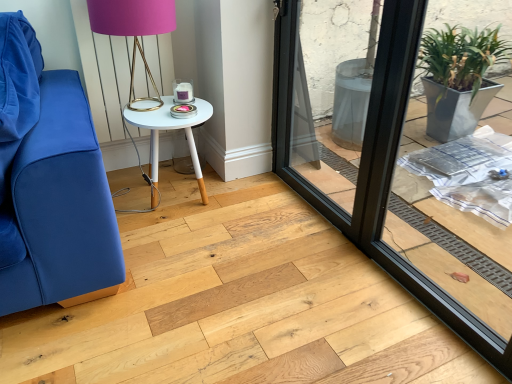
Question: Is matte gold table lamp at upper center to the left or to the right of black glass window frame at center in the image?

Choices:
 (A) left
 (B) right

Answer: (A)

Question: Is matte gold table lamp at upper center taller or shorter than black glass window frame at center?

Choices:
 (A) short
 (B) tall

Answer: (A)

Question: Considering the real-world distances, which object is closest to the white painted wood table at center?

Choices:
 (A) transparent glass screen door at center
 (B) matte gold table lamp at upper center
 (C) black glass window frame at center

Answer: (B)

Question: Which object is the closest to the matte gold table lamp at upper center?

Choices:
 (A) white painted wood table at center
 (B) transparent glass screen door at center
 (C) black glass window frame at center

Answer: (A)